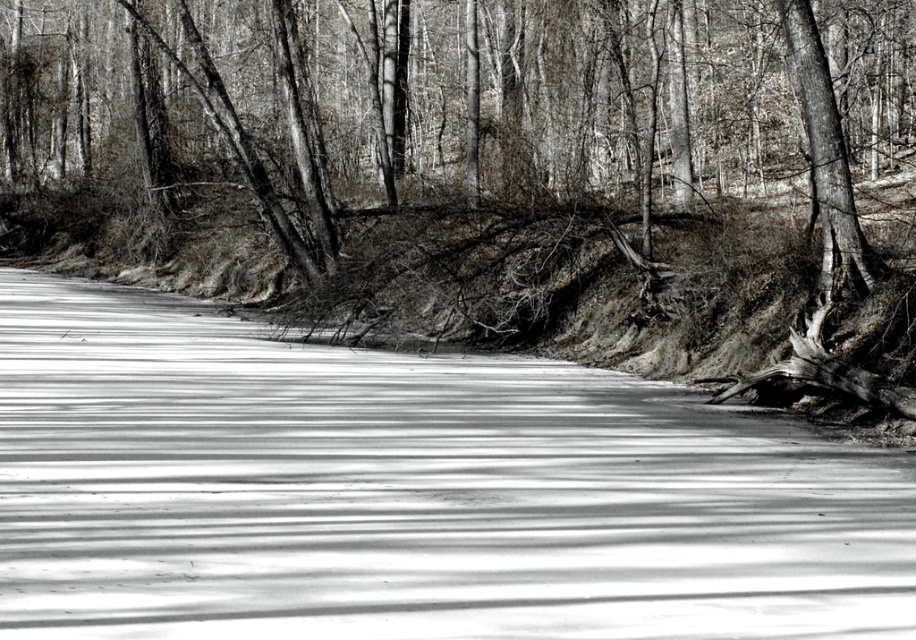
Question: Which point is farther to the camera?

Choices:
 (A) (1, 292)
 (B) (551, 140)

Answer: (B)

Question: Does smooth bark tree at center lie behind smooth ice at center?

Choices:
 (A) yes
 (B) no

Answer: (A)

Question: From the image, what is the correct spatial relationship of smooth bark tree at center in relation to smooth ice at center?

Choices:
 (A) above
 (B) below

Answer: (A)

Question: Can you confirm if smooth bark tree at center is positioned to the left of smooth ice at center?

Choices:
 (A) yes
 (B) no

Answer: (A)

Question: Which object appears farthest from the camera in this image?

Choices:
 (A) smooth ice at center
 (B) smooth bark tree at center

Answer: (B)